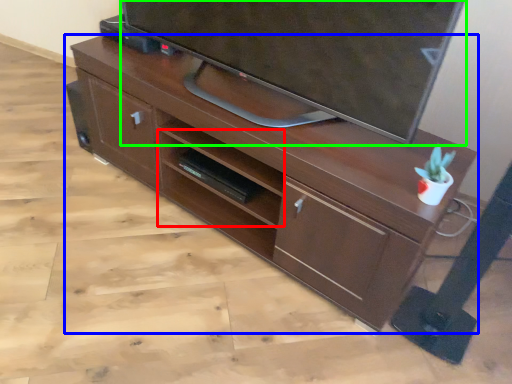
Question: Based on their relative distances, which object is farther from shelf (highlighted by a red box)? Choose from desk (highlighted by a blue box) and television (highlighted by a green box).

Choices:
 (A) desk
 (B) television

Answer: (B)